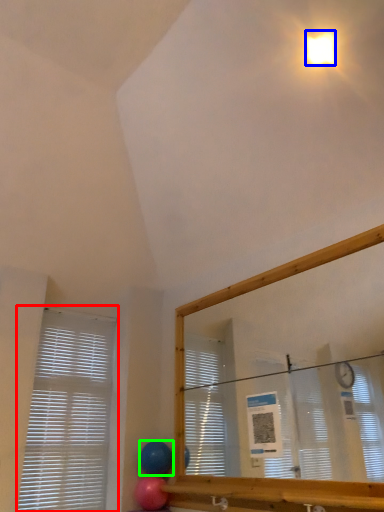
Question: Which object is the closest to the window blind (highlighted by a red box)? Choose among these: light (highlighted by a blue box) or balloon (highlighted by a green box).

Choices:
 (A) light
 (B) balloon

Answer: (B)